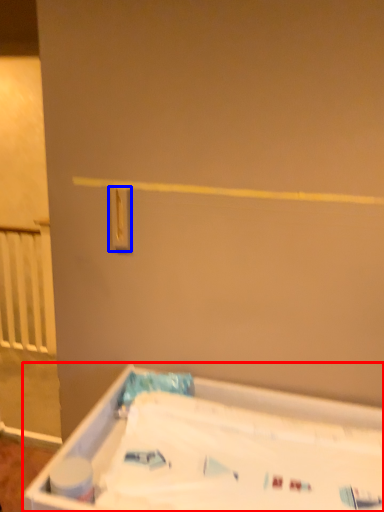
Question: Among these objects, which one is nearest to the camera, bathtub (highlighted by a red box) or light switch (highlighted by a blue box)?

Choices:
 (A) bathtub
 (B) light switch

Answer: (A)